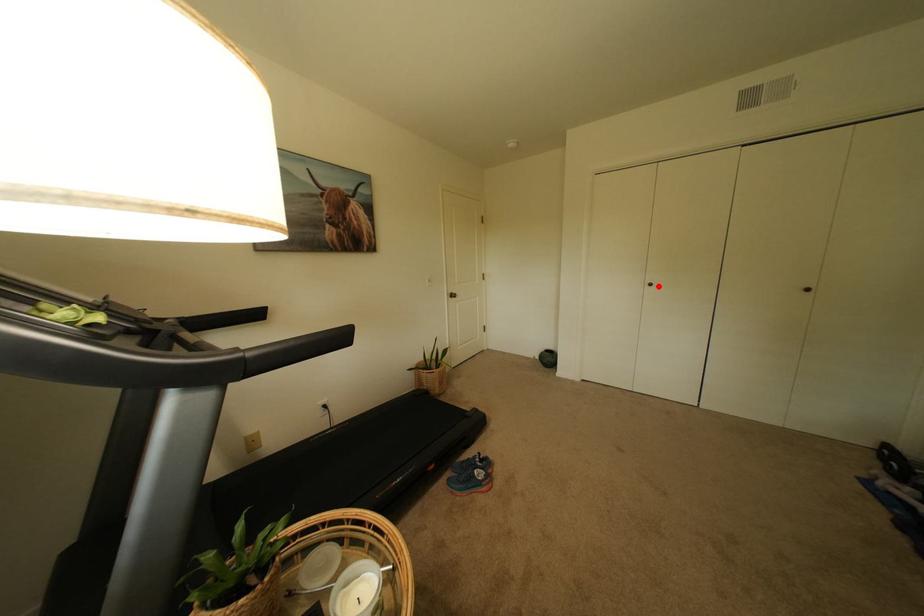
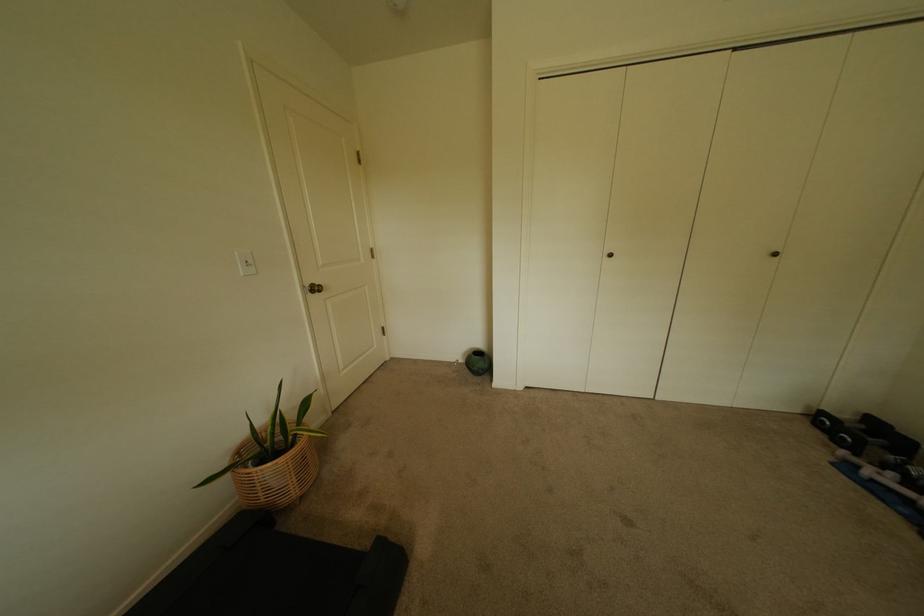
Where in the second image is the point corresponding to the highlighted location from the first image?

(618, 256)